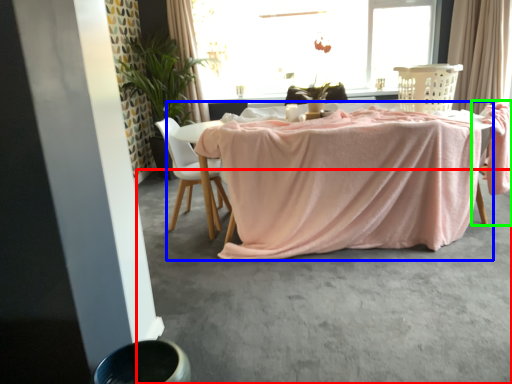
Question: Considering the real-world distances, which object is closest to concrete (highlighted by a red box)? table (highlighted by a blue box) or armchair (highlighted by a green box).

Choices:
 (A) table
 (B) armchair

Answer: (A)